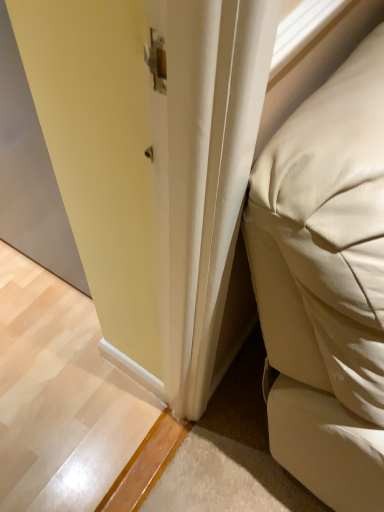
Question: Is matte gray screen door at left closer to the viewer compared to beige leather bed at right?

Choices:
 (A) no
 (B) yes

Answer: (A)

Question: Can you confirm if matte gray screen door at left is bigger than beige leather bed at right?

Choices:
 (A) yes
 (B) no

Answer: (B)

Question: Is matte gray screen door at left directly adjacent to beige leather bed at right?

Choices:
 (A) yes
 (B) no

Answer: (B)

Question: From a real-world perspective, is matte gray screen door at left positioned under beige leather bed at right based on gravity?

Choices:
 (A) yes
 (B) no

Answer: (A)

Question: Does matte gray screen door at left have a lesser width compared to beige leather bed at right?

Choices:
 (A) no
 (B) yes

Answer: (B)

Question: Considering the relative positions of matte gray screen door at left and beige leather bed at right in the image provided, is matte gray screen door at left behind beige leather bed at right?

Choices:
 (A) no
 (B) yes

Answer: (B)

Question: Is beige leather bed at right to the right of matte gray screen door at left from the viewer's perspective?

Choices:
 (A) yes
 (B) no

Answer: (A)

Question: From the image's perspective, would you say beige leather bed at right is positioned over matte gray screen door at left?

Choices:
 (A) yes
 (B) no

Answer: (B)

Question: Does beige leather bed at right turn towards matte gray screen door at left?

Choices:
 (A) yes
 (B) no

Answer: (B)

Question: Is beige leather bed at right taller than matte gray screen door at left?

Choices:
 (A) yes
 (B) no

Answer: (A)

Question: Considering the relative positions of beige leather bed at right and matte gray screen door at left in the image provided, is beige leather bed at right behind matte gray screen door at left?

Choices:
 (A) yes
 (B) no

Answer: (B)

Question: Would you say beige leather bed at right is outside matte gray screen door at left?

Choices:
 (A) yes
 (B) no

Answer: (A)

Question: Would you say beige leather bed at right is inside or outside matte gray screen door at left?

Choices:
 (A) outside
 (B) inside

Answer: (A)